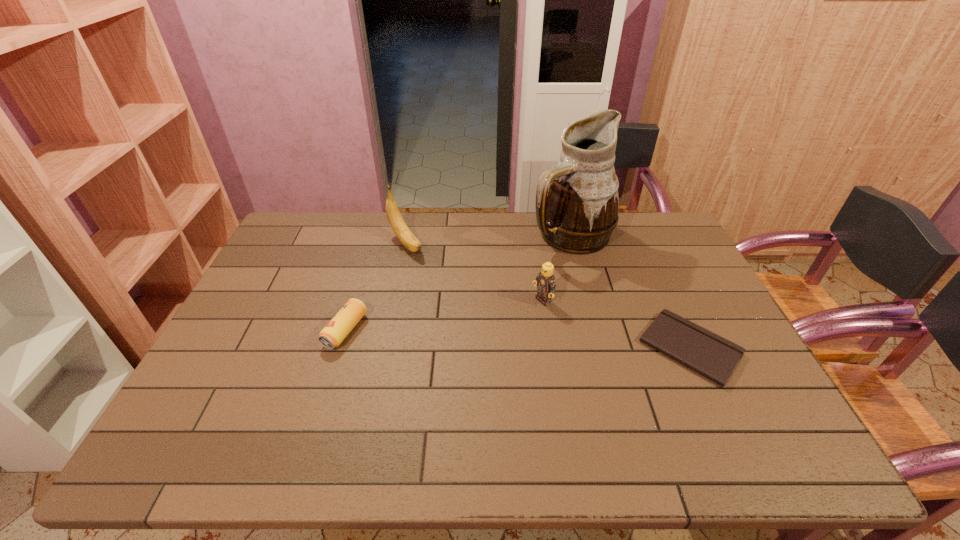
This screenshot has width=960, height=540. Identify the location of beer can. (332, 335).

The width and height of the screenshot is (960, 540). What are the coordinates of `the shortest object` in the screenshot? It's located at (712, 356).

Locate an element on the screen. This screenshot has height=540, width=960. banana is located at coordinates (396, 221).

This screenshot has height=540, width=960. Identify the location of the third tallest object. (545, 281).

Image resolution: width=960 pixels, height=540 pixels. I want to click on Lego, so click(545, 281).

Where is `pitcher`? pitcher is located at coordinates (577, 201).

Where is `free space located 0.190m on the back of the beer can`? free space located 0.190m on the back of the beer can is located at coordinates (365, 268).

Locate an element on the screen. free space located 0.080m on the left of the shortest object is located at coordinates point(611,348).

The height and width of the screenshot is (540, 960). In order to click on free spot located 0.050m at the start of the peel on the banana in this screenshot , I will do `click(422, 265)`.

You are a GUI agent. You are given a task and a screenshot of the screen. Output one action in this format:
    pyautogui.click(x=<x>, y=<y>)
    Task: Click on the vacant region located at the start of the peel on the banana
    This screenshot has height=540, width=960.
    Given the screenshot: What is the action you would take?
    pyautogui.click(x=459, y=301)